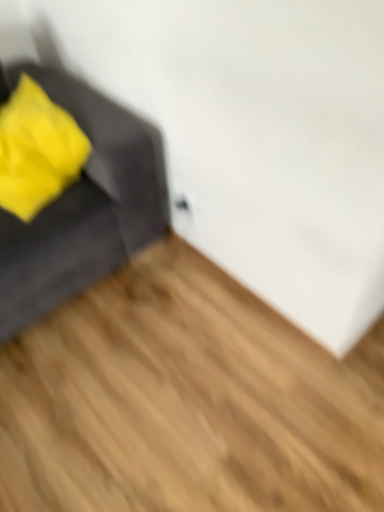
Question: Choose the correct answer: Is velvet gray sofa at left inside soft yellow fabric at left or outside it?

Choices:
 (A) outside
 (B) inside

Answer: (A)

Question: Considering the positions of velvet gray sofa at left and soft yellow fabric at left in the image, is velvet gray sofa at left taller or shorter than soft yellow fabric at left?

Choices:
 (A) tall
 (B) short

Answer: (A)

Question: Estimate the real-world distances between objects in this image. Which object is farther from the velvet gray sofa at left?

Choices:
 (A) light brown wood flooring at lower left
 (B) soft yellow fabric at left

Answer: (A)

Question: Which is nearer to the light brown wood flooring at lower left?

Choices:
 (A) soft yellow fabric at left
 (B) velvet gray sofa at left

Answer: (B)